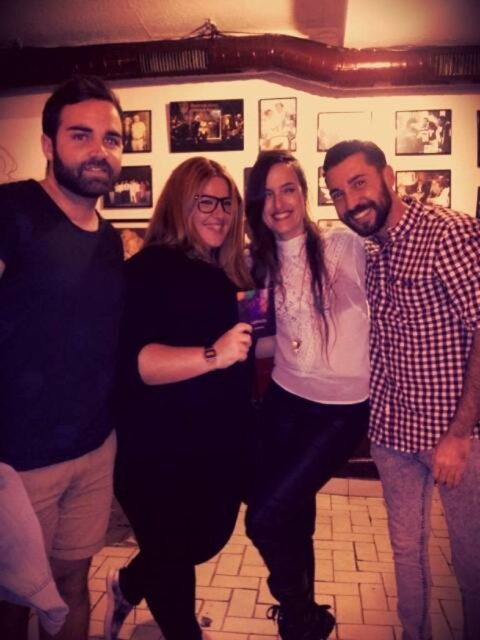
Is black matte shirt at left positioned behind wooden photo frame at upper center?

That is False.

Which of these two, black matte shirt at left or wooden photo frame at upper center, stands taller?

black matte shirt at left

Who is more forward, (119, 236) or (235, 113)?

Point (119, 236) is in front.

At what (x,y) coordinates should I click in order to perform the action: click on black matte shirt at left. Please return your answer as a coordinate pair (x, y). Looking at the image, I should click on (63, 333).

Is point (23, 307) positioned before point (446, 444)?

Yes, point (23, 307) is closer to viewer.

Is black matte shirt at left in front of red checkered shirt at right?

Yes, it is in front of red checkered shirt at right.

Describe the element at coordinates (63, 333) in the screenshot. I see `black matte shirt at left` at that location.

At what (x,y) coordinates should I click in order to perform the action: click on black matte shirt at left. Please return your answer as a coordinate pair (x, y). The width and height of the screenshot is (480, 640). Looking at the image, I should click on (63, 333).

Which of these two, red checkered shirt at right or wooden photo frame at upper center, stands shorter?

wooden photo frame at upper center is shorter.

The width and height of the screenshot is (480, 640). Find the location of `red checkered shirt at right`. red checkered shirt at right is located at coordinates (419, 371).